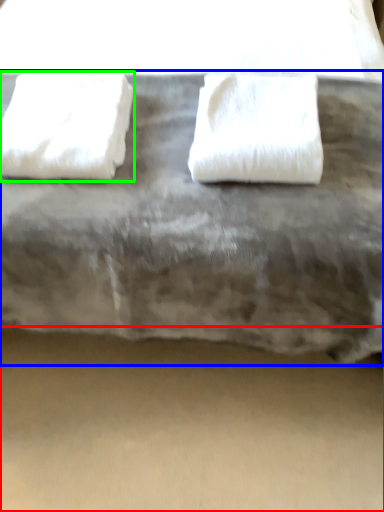
Question: Which object is the farthest from concrete (highlighted by a red box)? Choose among these: furniture (highlighted by a blue box) or towel (highlighted by a green box).

Choices:
 (A) furniture
 (B) towel

Answer: (B)